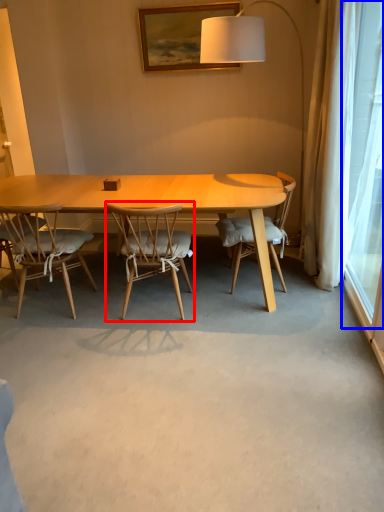
Question: Among these objects, which one is nearest to the camera, chair (highlighted by a red box) or window screen (highlighted by a blue box)?

Choices:
 (A) chair
 (B) window screen

Answer: (B)